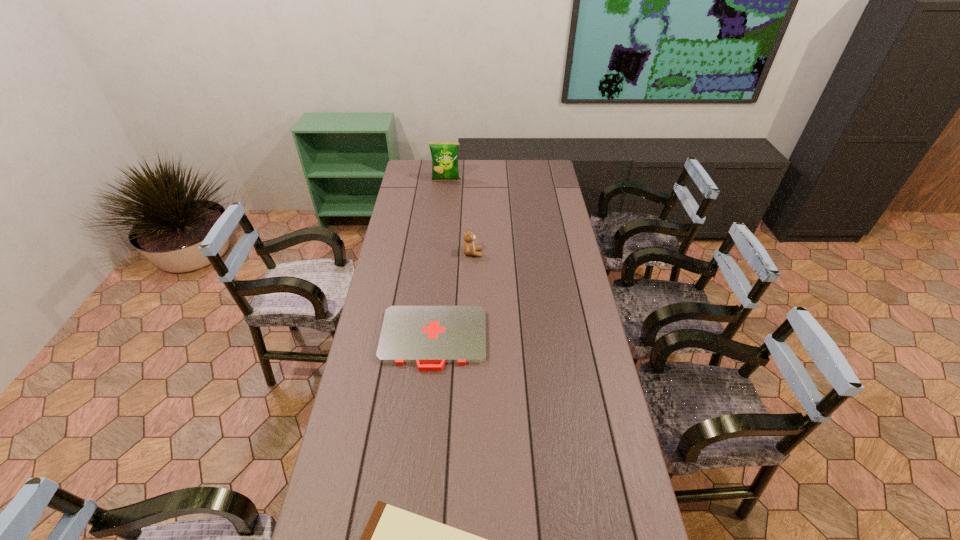
Select which object is the closest to the farthest object. Please provide its 2D coordinates. Your answer should be formatted as a tuple, i.e. [(x, y)], where the tuple contains the x and y coordinates of a point satisfying the conditions above.

[(469, 248)]

Identify the location of object that is the second closest to the third tallest object. (394, 539).

Locate an element on the screen. vacant point that satisfies the following two spatial constraints: 1. on the front-facing side of the second farthest object; 2. on handle side the first-aid kit is located at coordinates (471, 339).